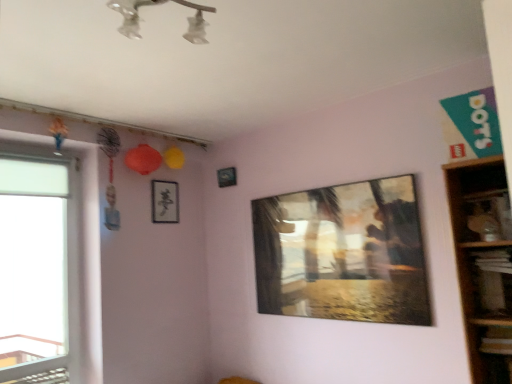
Question: From the image's perspective, relative to transparent glass window at left, is metallic rectangular frame at upper center, the 1th picture frame in the back-to-front sequence, above or below?

Choices:
 (A) above
 (B) below

Answer: (A)

Question: Considering the positions of metallic rectangular frame at upper center, which is the second picture frame from right to left, and transparent glass window at left in the image, is metallic rectangular frame at upper center, which is the second picture frame from right to left, taller or shorter than transparent glass window at left?

Choices:
 (A) tall
 (B) short

Answer: (B)

Question: Estimate the real-world distances between objects in this image. Which object is farther from the metallic rectangular frame at upper center, which is the second picture frame from right to left?

Choices:
 (A) wooden shelf at right
 (B) transparent glass window at left
 (C) black paper at upper center, arranged as the 2th picture frame when viewed from the front
 (D) metallic reflective painting at center, which is the first picture frame in right-to-left order

Answer: (A)

Question: Estimate the real-world distances between objects in this image. Which object is farther from the transparent glass window at left?

Choices:
 (A) black paper at upper center, which appears as the first picture frame when viewed from the left
 (B) metallic reflective painting at center, which is the first picture frame in right-to-left order
 (C) metallic rectangular frame at upper center, which is the second picture frame from right to left
 (D) wooden shelf at right

Answer: (D)